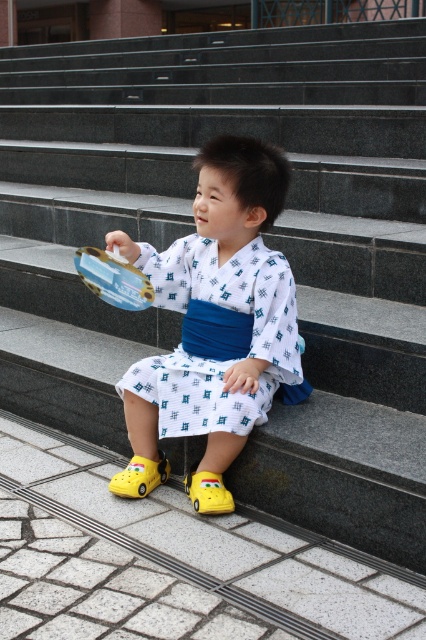
Who is higher up, metallic plastic toy car at center or yellow rubber shoe at lower left?

Positioned higher is metallic plastic toy car at center.

Is point (74, 253) positioned in front of point (233, 508)?

That is False.

I want to click on metallic plastic toy car at center, so click(x=114, y=278).

Can you confirm if metallic plastic toy car at center is positioned below yellow rubber shoe at lower center?

Incorrect, metallic plastic toy car at center is not positioned below yellow rubber shoe at lower center.

Find the location of a particular element. This screenshot has height=640, width=426. metallic plastic toy car at center is located at coordinates click(x=114, y=278).

This screenshot has width=426, height=640. I want to click on metallic plastic toy car at center, so click(x=114, y=278).

Is white printed kimono at center behind metallic plastic toy car at center?

No, white printed kimono at center is closer to the viewer.

Who is positioned more to the left, white printed kimono at center or metallic plastic toy car at center?

metallic plastic toy car at center is more to the left.

Which is behind, point (250, 236) or point (123, 300)?

The point (250, 236) is more distant.

What are the coordinates of `white printed kimono at center` in the screenshot? It's located at (218, 310).